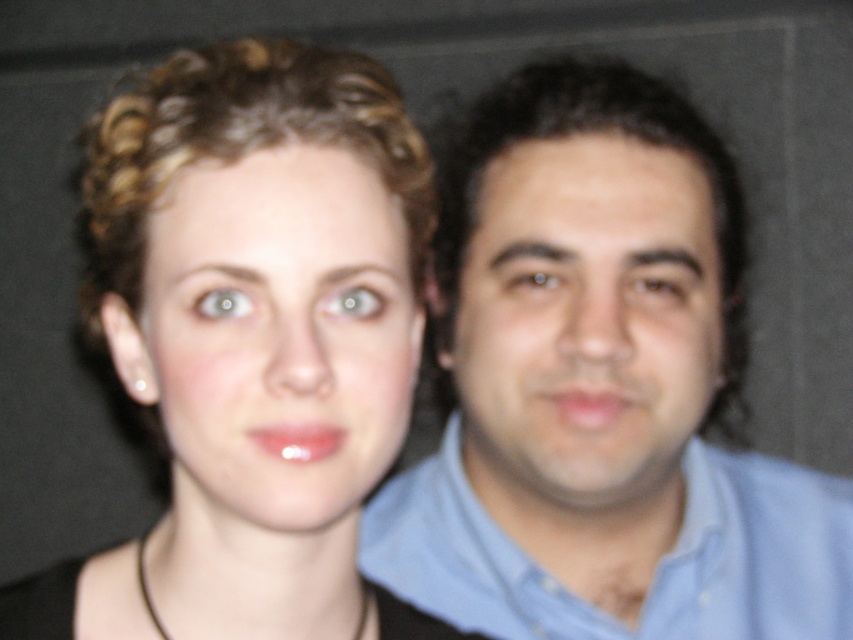
You are organizing a clothing rack and need to place the blue shirt at right and the blue cotton shirt at right in a specific order. According to the image, which one should be placed to the left of the other?

The blue shirt at right should be placed to the left of the blue cotton shirt at right because it is positioned on the left side of the blue cotton shirt at right in the image.

You are taking a photo of two people. You need to place a small decorative item between the matte black hair at center and the smooth skin face at right. Based on their positions, where should you place the item?

The matte black hair at center is to the left of the smooth skin face at right, so you should place the item between them on the left side of the smooth skin face at right and the right side of the matte black hair at center.